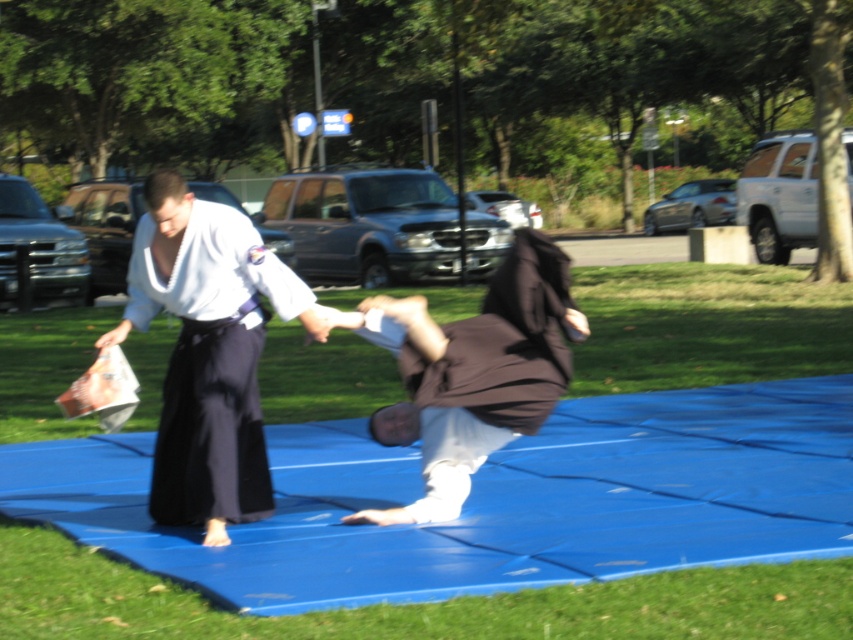
You are a photographer standing at the edge of the blue mat. You want to take a photo of the dark blue cotton kimono at center and the brown fabric monk at center. If your camera has a maximum focus range of 27 inches, will both objects be in focus?

The dark blue cotton kimono at center and brown fabric monk at center are 27.62 inches apart from each other. Since the distance between them exceeds the camera maximum focus range of 27 inches, the camera may not be able to keep both objects in focus simultaneously.

You are a photographer planning to take a picture of the martial arts practitioners. The dark blue cotton kimono at center is placed at coordinates point 0.567, 0.249. If you want to ensure the kimono is centered in your frame, what adjustment should you make to your camera position?

The dark blue cotton kimono at center is already positioned at point (212, 362). To center it in the frame, adjust the camera so the kimono aligns with the center coordinates of the image, which is typically at point (426, 320). Move the camera slightly to the left and upward to shift the kimono towards the center.